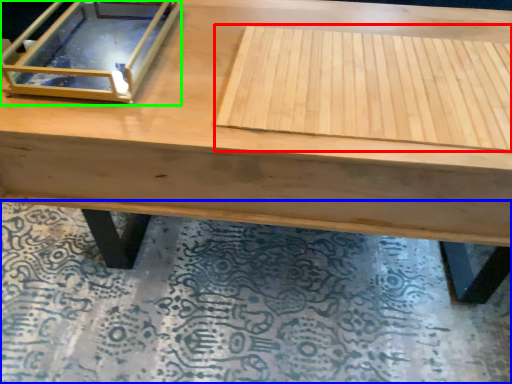
Question: Considering the real-world distances, which object is farthest from plywood (highlighted by a red box)? mat (highlighted by a blue box) or glass box (highlighted by a green box)?

Choices:
 (A) mat
 (B) glass box

Answer: (A)